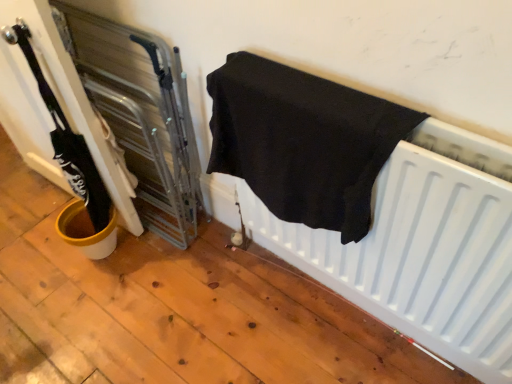
Describe the element at coordinates (423, 247) in the screenshot. I see `white matte radiator at lower right` at that location.

This screenshot has width=512, height=384. What are the coordinates of `white matte radiator at lower right` in the screenshot? It's located at (423, 247).

The height and width of the screenshot is (384, 512). Describe the element at coordinates (303, 141) in the screenshot. I see `black fabric towel at center` at that location.

In order to face black fabric towel at center, should I rotate leftwards or rightwards?

It's best to rotate right around 4.903 degrees.

Identify the location of black fabric towel at center. The height and width of the screenshot is (384, 512). (303, 141).

Where is `white matte radiator at lower right`? This screenshot has height=384, width=512. white matte radiator at lower right is located at coordinates (423, 247).

Based on their positions, is white matte radiator at lower right located to the left or right of black fabric towel at center?

white matte radiator at lower right is to the right of black fabric towel at center.

Who is more distant, white matte radiator at lower right or black fabric towel at center?

white matte radiator at lower right is more distant.

Considering the positions of point (389, 191) and point (323, 111), is point (389, 191) closer or farther from the camera than point (323, 111)?

Point (389, 191).

From the image's perspective, which one is positioned lower, white matte radiator at lower right or black fabric towel at center?

white matte radiator at lower right, from the image's perspective.

In the scene shown: From a real-world perspective, between white matte radiator at lower right and black fabric towel at center, who is vertically higher?

black fabric towel at center, from a real-world perspective.

Which of these two, white matte radiator at lower right or black fabric towel at center, is thinner?

white matte radiator at lower right.

Is white matte radiator at lower right taller than black fabric towel at center?

In fact, white matte radiator at lower right may be shorter than black fabric towel at center.

In the scene shown: Who is bigger, white matte radiator at lower right or black fabric towel at center?

black fabric towel at center.

Is white matte radiator at lower right not within black fabric towel at center?

Indeed, white matte radiator at lower right is completely outside black fabric towel at center.

Is white matte radiator at lower right beside black fabric towel at center?

No.

Is white matte radiator at lower right turned away from black fabric towel at center?

white matte radiator at lower right is not turned away from black fabric towel at center.

How different are the orientations of white matte radiator at lower right and black fabric towel at center in degrees?

They differ by 0.882 degrees in their facing directions.

How distant is white matte radiator at lower right from black fabric towel at center?

A distance of 16.67 centimeters exists between white matte radiator at lower right and black fabric towel at center.

Where is `radiator directly beneath the black fabric towel at center (from a real-world perspective)`? The image size is (512, 384). radiator directly beneath the black fabric towel at center (from a real-world perspective) is located at coordinates (423, 247).

Which is more to the right, black fabric towel at center or white matte radiator at lower right?

white matte radiator at lower right.

Which object is further away from the camera, black fabric towel at center or white matte radiator at lower right?

white matte radiator at lower right.

Which is farther, (354, 196) or (508, 203)?

Point (354, 196)

From the image's perspective, which one is positioned higher, black fabric towel at center or white matte radiator at lower right?

black fabric towel at center appears higher in the image.

From a real-world perspective, is black fabric towel at center on white matte radiator at lower right?

Correct, in the physical world, black fabric towel at center is higher than white matte radiator at lower right.

Can you confirm if black fabric towel at center is thinner than white matte radiator at lower right?

No, black fabric towel at center is not thinner than white matte radiator at lower right.

From their relative heights in the image, would you say black fabric towel at center is taller or shorter than white matte radiator at lower right?

black fabric towel at center is taller than white matte radiator at lower right.

In terms of size, does black fabric towel at center appear bigger or smaller than white matte radiator at lower right?

Considering their sizes, black fabric towel at center takes up more space than white matte radiator at lower right.

Do you think black fabric towel at center is within white matte radiator at lower right, or outside of it?

black fabric towel at center is not inside white matte radiator at lower right, it's outside.

Based on the photo, is the surface of black fabric towel at center in direct contact with white matte radiator at lower right?

No, black fabric towel at center is not beside white matte radiator at lower right.

Is black fabric towel at center oriented away from white matte radiator at lower right?

black fabric towel at center does not have its back to white matte radiator at lower right.

Can you tell me how much black fabric towel at center and white matte radiator at lower right differ in facing direction?

The angle between the facing direction of black fabric towel at center and the facing direction of white matte radiator at lower right is 0.882 degrees.

This screenshot has width=512, height=384. Identify the location of radiator behind the black fabric towel at center. (423, 247).

I want to click on towel on the left of white matte radiator at lower right, so click(303, 141).

I want to click on towel lying in front of the white matte radiator at lower right, so pos(303,141).